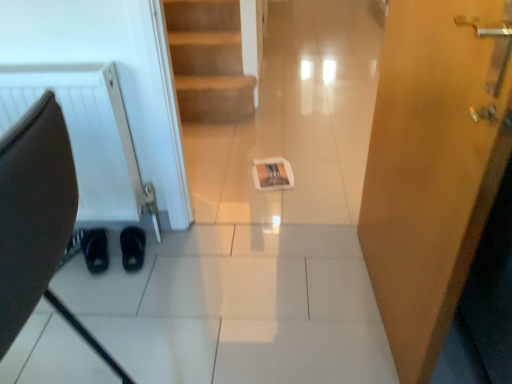
You are a GUI agent. You are given a task and a screenshot of the screen. Output one action in this format:
    pyautogui.click(x=<x>, y=<y>)
    Task: Click on the free space in front of black suede shoes at lower left, the first footwear from the left
    This screenshot has height=384, width=512.
    Given the screenshot: What is the action you would take?
    pyautogui.click(x=83, y=283)